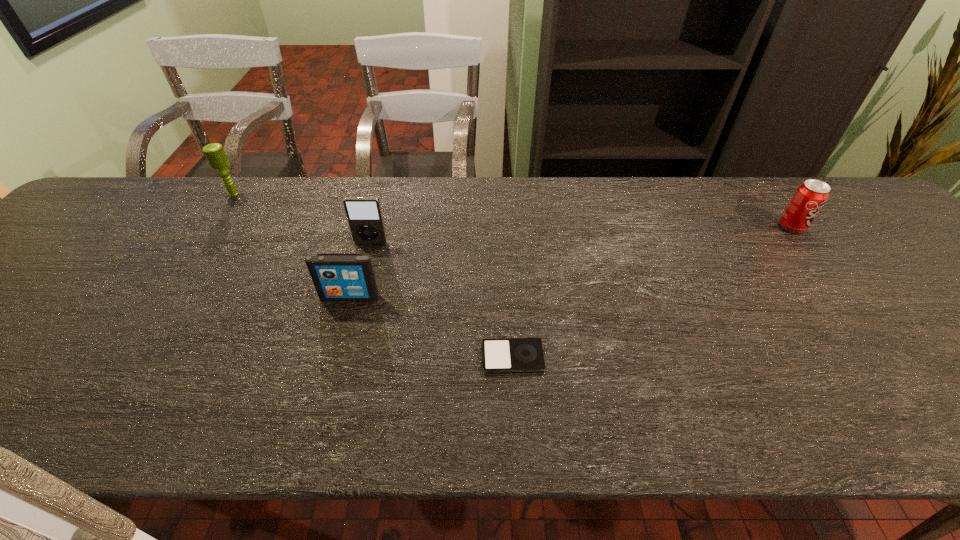
I want to click on free point at the far right corner, so click(x=842, y=177).

Locate an element on the screen. The width and height of the screenshot is (960, 540). free spot between the rightmost object and the nearest object is located at coordinates (652, 292).

Identify the location of empty space that is in between the microphone and the third farthest object. This screenshot has width=960, height=540. (302, 219).

Identify the location of free space between the rightmost object and the third nearest object. (581, 235).

Identify the location of vacant space in between the second nearest iPod and the soda. The image size is (960, 540). (571, 262).

This screenshot has height=540, width=960. I want to click on free spot between the fourth nearest object and the farthest object, so click(x=513, y=211).

The height and width of the screenshot is (540, 960). In order to click on empty location between the second object from right to left and the third nearest object in this screenshot , I will do `click(442, 300)`.

Image resolution: width=960 pixels, height=540 pixels. Find the location of `free space between the fourth farthest object and the rightmost object`. free space between the fourth farthest object and the rightmost object is located at coordinates (571, 262).

Identify which object is the third closest to the farthest iPod. Please provide its 2D coordinates. Your answer should be formatted as a tuple, i.e. [(x, y)], where the tuple contains the x and y coordinates of a point satisfying the conditions above.

[(214, 152)]

Point out which object is positioned as the fourth nearest to the farthest object. Please provide its 2D coordinates. Your answer should be formatted as a tuple, i.e. [(x, y)], where the tuple contains the x and y coordinates of a point satisfying the conditions above.

[(810, 197)]